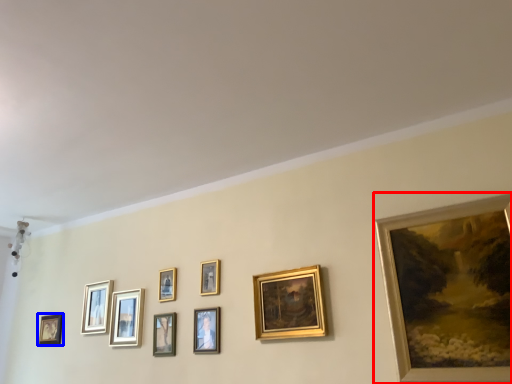
Question: Among these objects, which one is farthest to the camera, picture frame (highlighted by a red box) or picture frame (highlighted by a blue box)?

Choices:
 (A) picture frame
 (B) picture frame

Answer: (B)